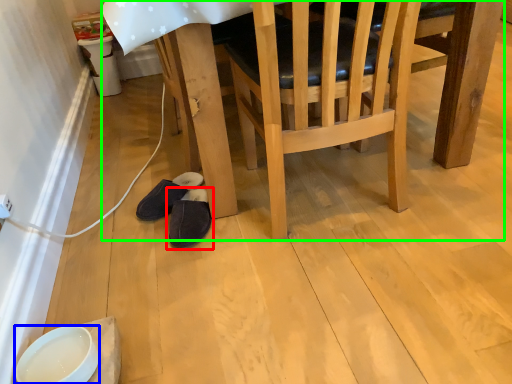
Question: Based on their relative distances, which object is nearer to footwear (highlighted by a red box)? Choose from bowl (highlighted by a blue box) and table (highlighted by a green box).

Choices:
 (A) bowl
 (B) table

Answer: (B)